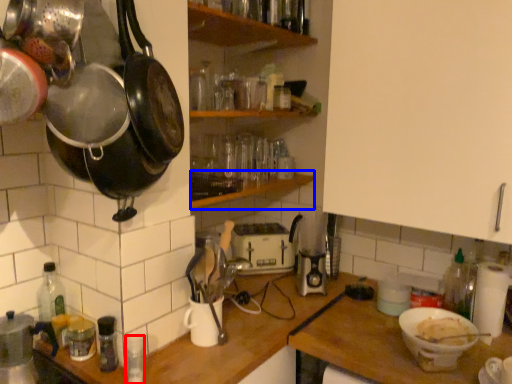
Question: Among these objects, which one is nearest to the camera, bottle (highlighted by a red box) or shelf (highlighted by a blue box)?

Choices:
 (A) bottle
 (B) shelf

Answer: (A)